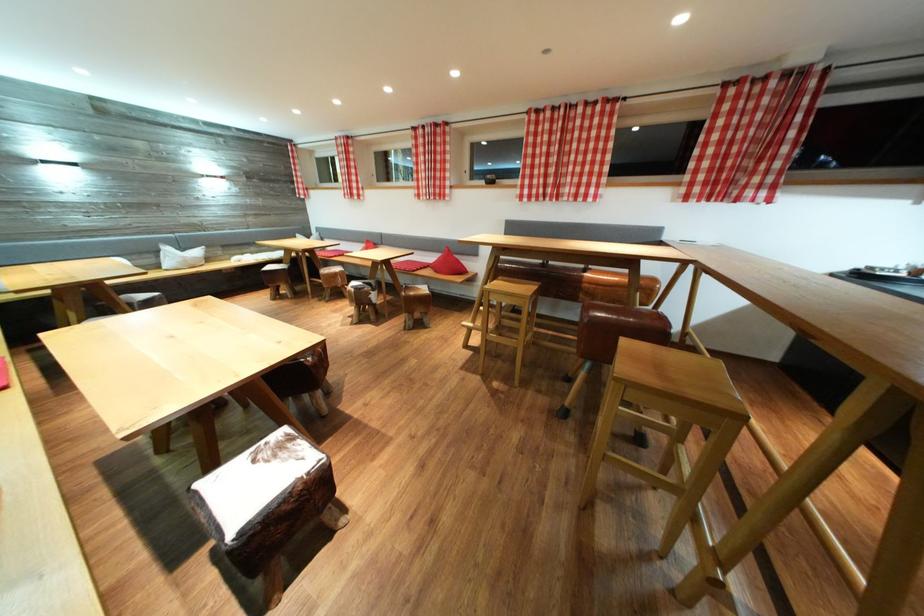
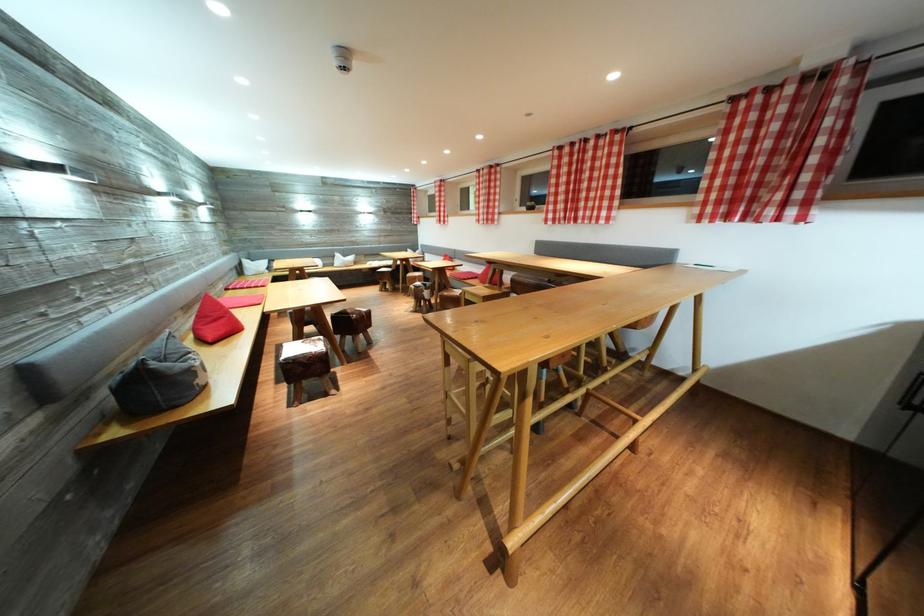
The point at (321, 370) is marked in the first image. Where is the corresponding point in the second image?

(362, 325)